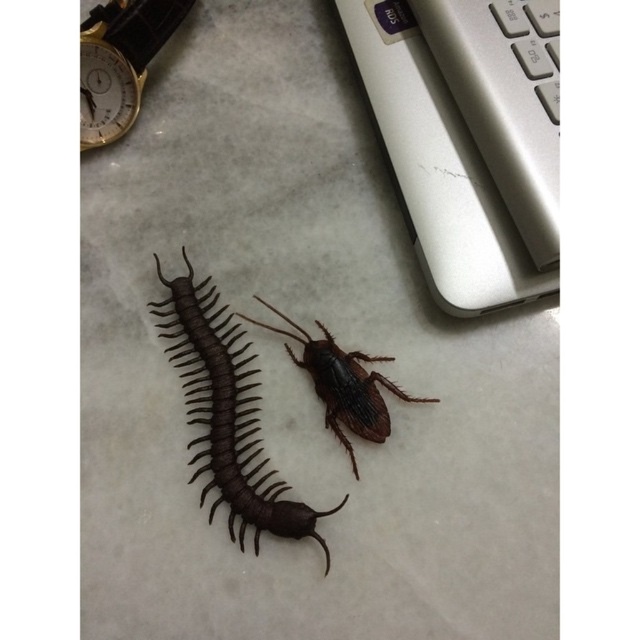
You are an interior designer arranging decorative items on a table. You have the shiny brown beetle at center and the gold metallic clock at upper left. Which item should you place higher up to ensure they look balanced in height?

The shiny brown beetle at center is much taller than the gold metallic clock at upper left, so you should place the gold metallic clock at upper left higher up to balance their heights.

You are trying to place a decorative gold metallic clock at upper left on the shelf next to a shiny brown beetle at center. Which object has a larger width?

The shiny brown beetle at center might be wider than gold metallic clock at upper left, so it is possible that the beetle is wider.